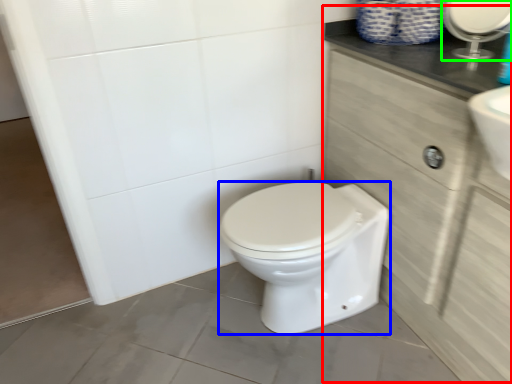
Question: Considering the real-world distances, which object is closest to cabinetry (highlighted by a red box)? bidet (highlighted by a blue box) or mirror (highlighted by a green box).

Choices:
 (A) bidet
 (B) mirror

Answer: (A)